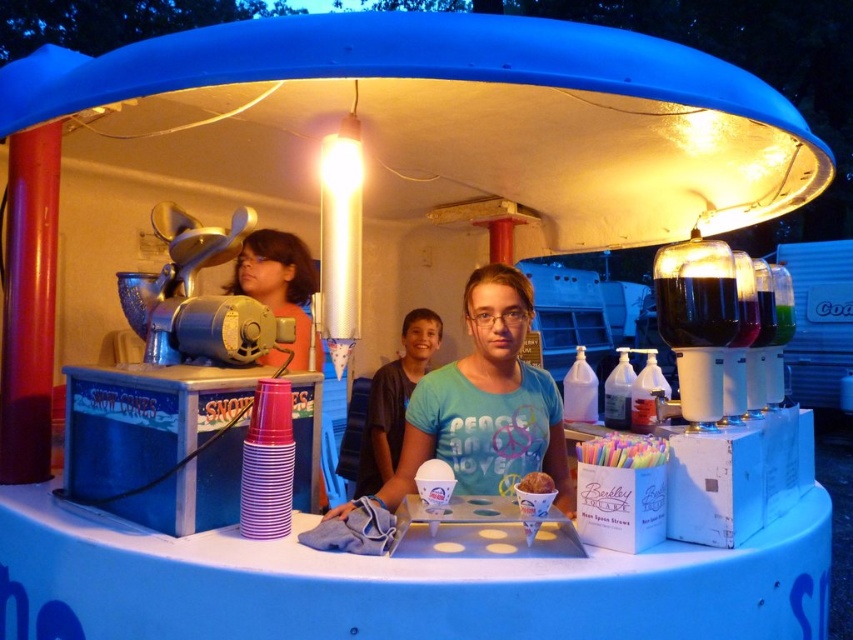
Question: Is blue cotton shirt at center positioned at the back of golden brown pastry at center?

Choices:
 (A) no
 (B) yes

Answer: (B)

Question: Which of these objects is positioned closest to the green matte t-shirt at center?

Choices:
 (A) black glass cup at center right
 (B) matte black hair at center
 (C) blue cotton shirt at center

Answer: (B)

Question: Which point is closer to the camera?

Choices:
 (A) golden brown pastry at center
 (B) blue cotton shirt at center

Answer: (A)

Question: Does green matte t-shirt at center appear on the right side of golden brown pastry at center?

Choices:
 (A) no
 (B) yes

Answer: (A)

Question: Is matte black hair at center to the right of golden brown pastry at center from the viewer's perspective?

Choices:
 (A) yes
 (B) no

Answer: (B)

Question: Which point is farther to the camera?

Choices:
 (A) [x=410, y=412]
 (B) [x=722, y=284]
 (C) [x=390, y=452]
 (D) [x=544, y=486]

Answer: (C)